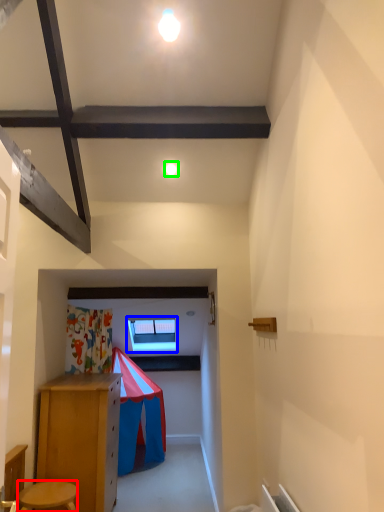
Question: Which object is positioned closest to stool (highlighted by a red box)? Select from window (highlighted by a blue box) and light (highlighted by a green box).

Choices:
 (A) window
 (B) light

Answer: (B)